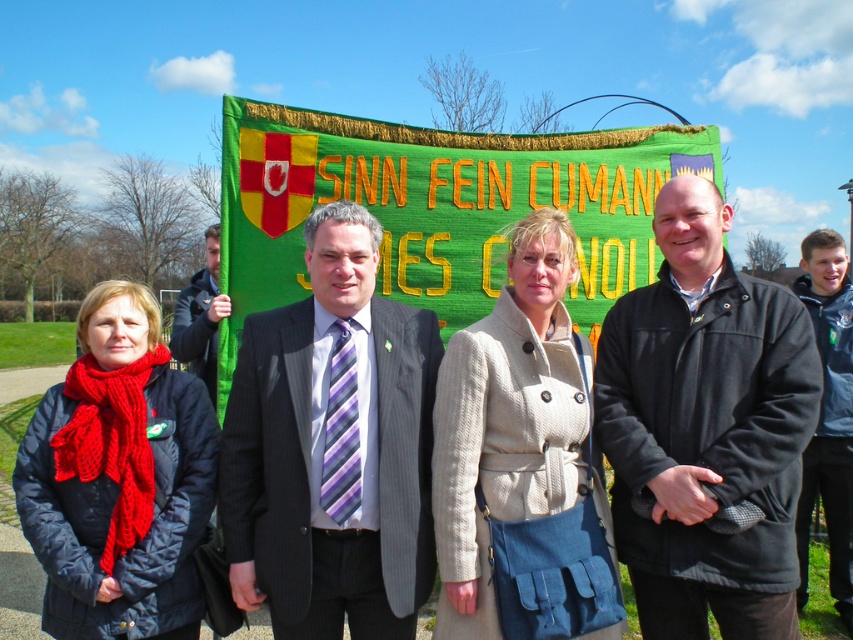
Can you confirm if beige woolen coat at center is smaller than dark gray jacket at center?

Yes, beige woolen coat at center is smaller than dark gray jacket at center.

Identify the location of beige woolen coat at center. (521, 461).

Which is behind, point (554, 403) or point (213, 284)?

The point (213, 284) is more distant.

Locate an element on the screen. The height and width of the screenshot is (640, 853). beige woolen coat at center is located at coordinates (521, 461).

Which is in front, point (439, 461) or point (120, 486)?

Positioned in front is point (120, 486).

Between point (514, 248) and point (32, 451), which one is positioned behind?

Point (514, 248)

This screenshot has width=853, height=640. I want to click on beige woolen coat at center, so click(x=521, y=461).

Is dark gray pinstripe suit at center closer to the viewer compared to dark gray jacket at center?

Yes, it is.

Which is in front, point (321, 310) or point (202, 333)?

Positioned in front is point (321, 310).

Locate an element on the screen. The image size is (853, 640). dark gray pinstripe suit at center is located at coordinates (332, 448).